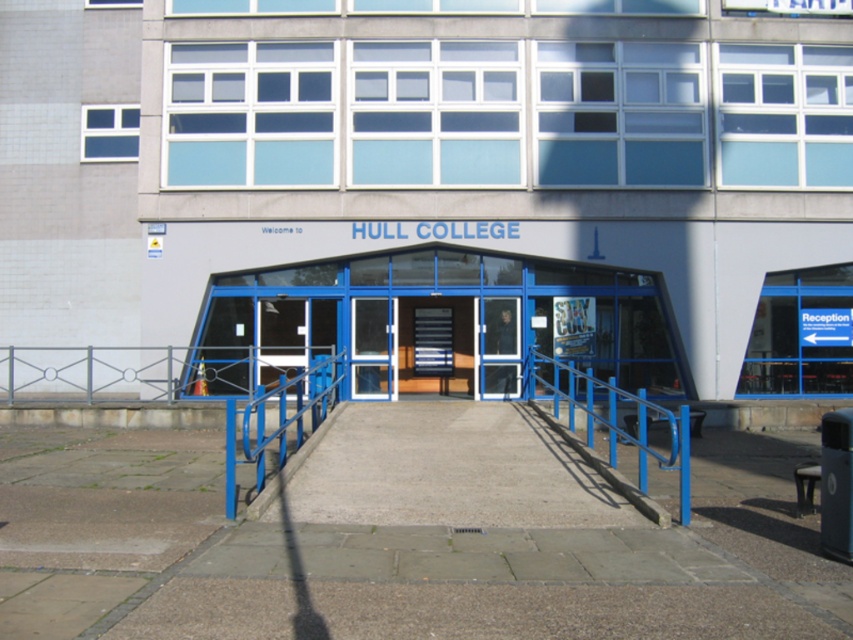
Between blue metallic rail at center and transparent glass door at center, which one has less height?

blue metallic rail at center is shorter.

Can you confirm if blue metallic rail at center is taller than transparent glass door at center?

No.

At what (x,y) coordinates should I click in order to perform the action: click on blue metallic rail at center. Please return your answer as a coordinate pair (x, y). This screenshot has height=640, width=853. Looking at the image, I should click on (279, 419).

Find the location of `blue metallic rail at center`. blue metallic rail at center is located at coordinates (279, 419).

Is transparent glass door at center smaller than wooden staircase at center?

Incorrect, transparent glass door at center is not smaller in size than wooden staircase at center.

Between point (489, 301) and point (438, 324), which one is positioned in front?

Point (489, 301) is in front.

Is point (500, 332) closer to camera compared to point (418, 346)?

Yes, point (500, 332) is closer to viewer.

This screenshot has height=640, width=853. Identify the location of transparent glass door at center. (500, 348).

Does blue metallic handrail at center appear under wooden staircase at center?

Yes.

Is blue metallic handrail at center shorter than wooden staircase at center?

Indeed, blue metallic handrail at center has a lesser height compared to wooden staircase at center.

Where is `blue metallic handrail at center`? This screenshot has height=640, width=853. blue metallic handrail at center is located at coordinates (616, 420).

Identify the location of blue metallic handrail at center. The image size is (853, 640). (616, 420).